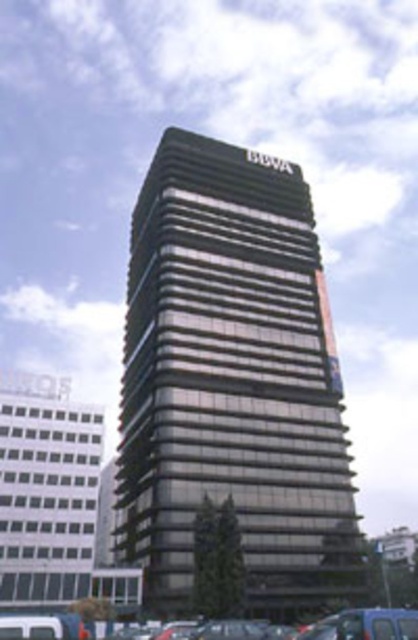
You are standing in front of the high rise building and want to take a photo. You notice two points on the building marked as point 1 at coordinates point (305, 269) and point 2 at coordinates point (413, 618). Which point is closer to your camera?

Point (305, 269) is further to the camera than point (413, 618). Therefore, point (413, 618) is closer to the camera.

You are standing at the point indicated by point (232, 384). What can you see in front of you?

The point (232, 384) indicates the metallic glass tower at center, so you can see the metallic glass tower in front of you.

You are a drone operator trying to capture a photo of the metallic glass tower at center. You notice metallic gray cars at lower center might block the view. Based on the scene description, will the cars block the tower in your photo?

The metallic glass tower at center is much taller than metallic gray cars at lower center, so the cars will not block the tower in the photo.